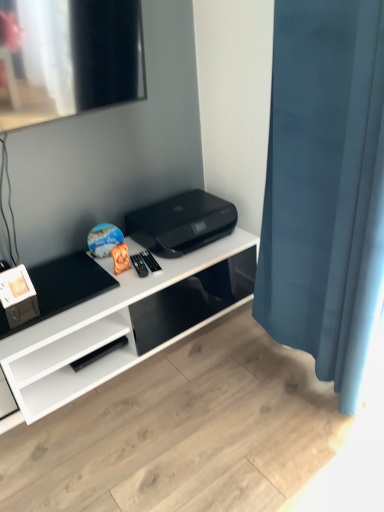
Question: From a real-world perspective, is white glossy desk at center above or below blue velvet curtain at right?

Choices:
 (A) above
 (B) below

Answer: (B)

Question: Is point (26, 417) positioned closer to the camera than point (289, 202)?

Choices:
 (A) farther
 (B) closer

Answer: (A)

Question: Which object is the closest to the black plastic printer at center?

Choices:
 (A) blue velvet curtain at right
 (B) white glossy desk at center

Answer: (B)

Question: Which object is positioned closest to the blue velvet curtain at right?

Choices:
 (A) white glossy desk at center
 (B) black plastic printer at center

Answer: (B)